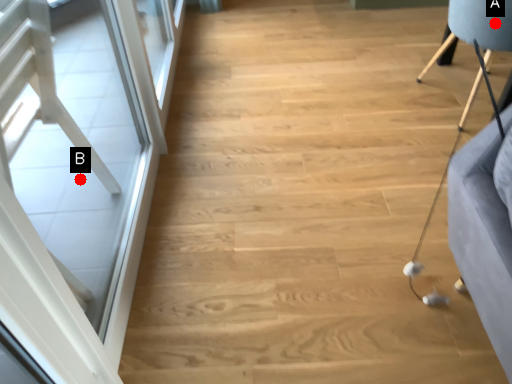
Question: Two points are circled on the image, labeled by A and B beside each circle. Which of the following is the closest to the observer?

Choices:
 (A) A is closer
 (B) B is closer

Answer: (A)